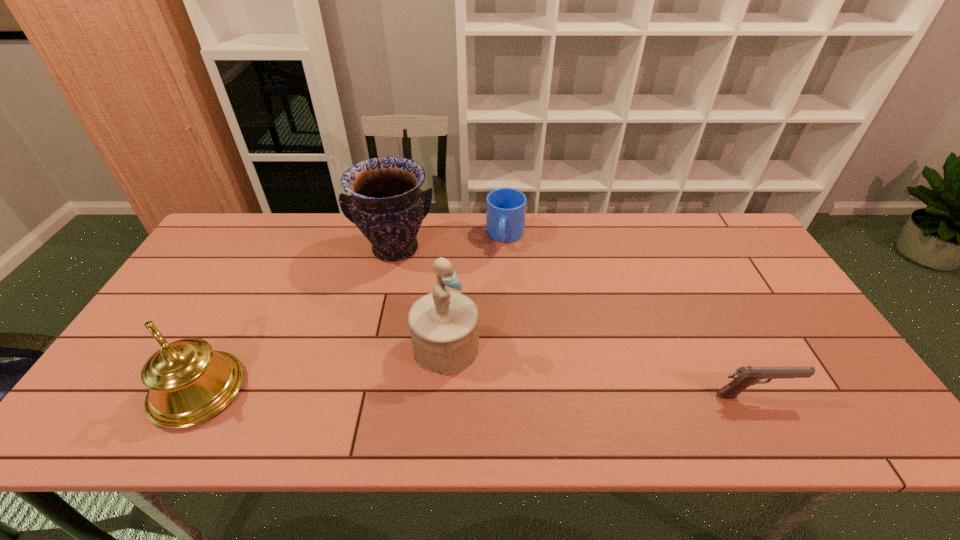
At what (x,y) coordinates should I click in order to perform the action: click on vacant area that lies between the figurine and the fourth object from left to right. Please return your answer as a coordinate pair (x, y). This screenshot has width=960, height=540. Looking at the image, I should click on (475, 291).

What are the coordinates of `blank region between the bell and the pottery` in the screenshot? It's located at (297, 320).

The width and height of the screenshot is (960, 540). I want to click on free point between the leftmost object and the shortest object, so click(x=476, y=393).

In order to click on vacant area that lies between the mug and the figurine in this screenshot , I will do click(475, 291).

Identify the location of free space between the leftmost object and the figurine. This screenshot has height=540, width=960. [x=322, y=369].

Where is `empty space between the rightmost object and the pottery`? This screenshot has height=540, width=960. empty space between the rightmost object and the pottery is located at coordinates (574, 322).

Image resolution: width=960 pixels, height=540 pixels. In order to click on empty space that is in between the rightmost object and the fourth object from left to right in this screenshot , I will do `click(630, 316)`.

Identify the location of vacant area that lies between the bell and the figurine. (322, 369).

Image resolution: width=960 pixels, height=540 pixels. What are the coordinates of `object that is the fourth closest to the pistol` in the screenshot? It's located at (189, 383).

Identify the location of the second closest object to the fourth object from left to right. The height and width of the screenshot is (540, 960). (444, 329).